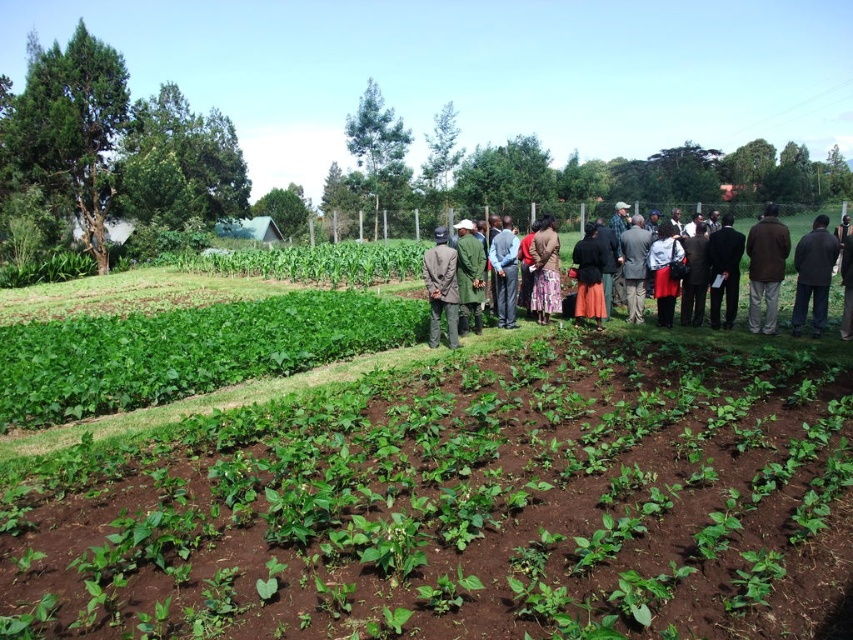
You are standing at the grassy area between the cultivated field and the group of people. You see two points marked in the image. Which point is closer to you? The points are point (485, 262) and point (543, 232).

Point (485, 262) is in front of point (543, 232), so it is closer to you.

You are a photographer trying to capture a clear photo of the black suit at center and the dark blue fabric at center. Which object should you focus on first to ensure both are in focus without moving the camera?

The black suit at center is in front of the dark blue fabric at center. To ensure both are in focus, you should focus on the black suit at center first since it is closer to the camera.